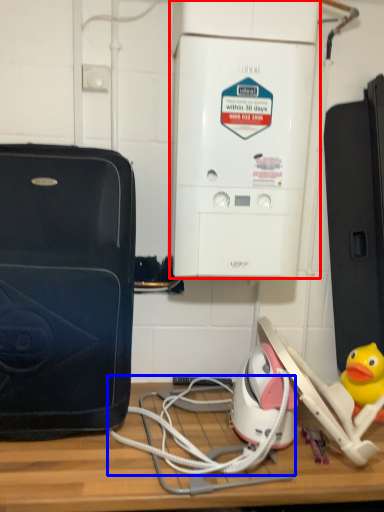
Question: Which object appears closest to the camera in this image, home appliance (highlighted by a red box) or cable (highlighted by a blue box)?

Choices:
 (A) home appliance
 (B) cable

Answer: (B)